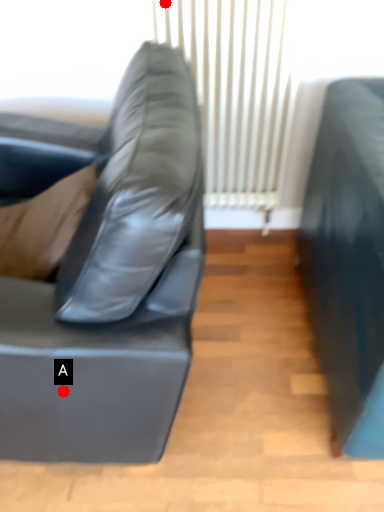
Question: Two points are circled on the image, labeled by A and B beside each circle. Which of the following is the farthest from the observer?

Choices:
 (A) A is further
 (B) B is further

Answer: (B)